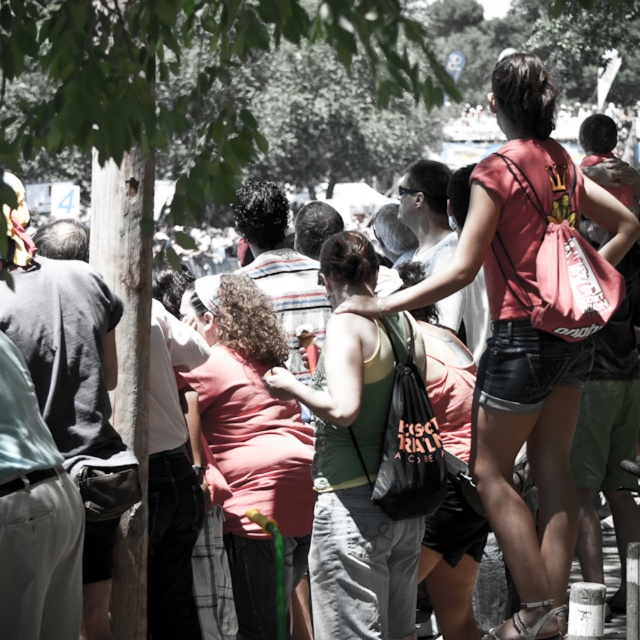
You are a photographer trying to capture a candid shot of two people in the crowd. You notice the green fabric tank top at center and the pink fabric shirt at center. Which clothing item is wider when viewed from your camera lens?

The green fabric tank top at center is wider than the pink fabric shirt at center.